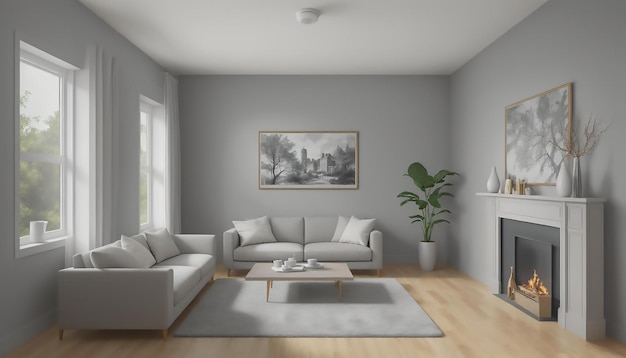
This screenshot has width=626, height=358. I want to click on plant, so click(423, 181).